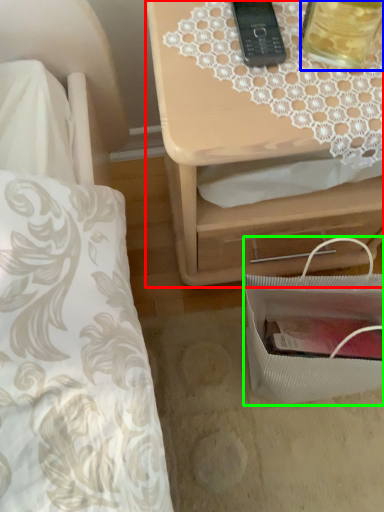
Question: Based on their relative distances, which object is nearer to nightstand (highlighted by a red box)? Choose from beverage (highlighted by a blue box) and bag (highlighted by a green box).

Choices:
 (A) beverage
 (B) bag

Answer: (B)